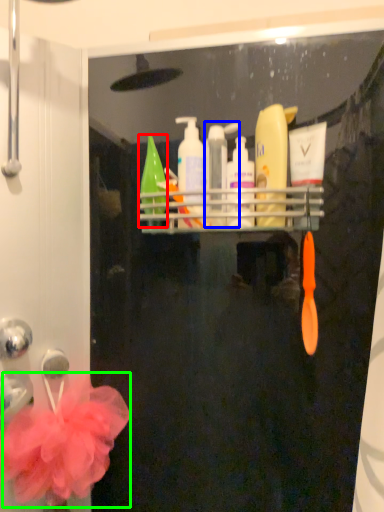
Question: Which object is the farthest from cleaning product (highlighted by a red box)? Choose among these: mouthwash (highlighted by a blue box) or flower (highlighted by a green box).

Choices:
 (A) mouthwash
 (B) flower

Answer: (B)